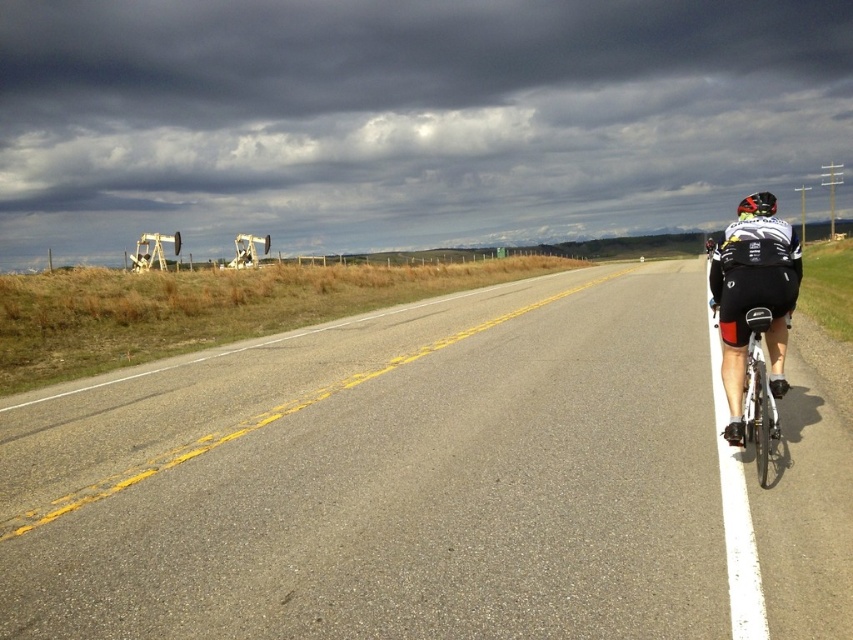
You are a cyclist approaching the shiny black helmet at right. Which direction should you turn to reach the asphalt road at center?

The asphalt road at center is to the left of the shiny black helmet at right, so you should turn left to reach it.

You are a cyclist approaching the road with two oil derricks on the left. You need to reach a point marked at coordinates (428, 481). According to the image, where exactly is this point located?

The point marked at coordinates (428, 481) is on the asphalt road at center, so you should head towards the center of the road to reach it.

You are a cyclist approaching a narrow bridge ahead. You see a black matte cycling jersey at right and a white metallic bicycle at right in your path. Which object should you steer around to avoid collision?

You should steer around the white metallic bicycle at right because the black matte cycling jersey at right is to the left of it, meaning the bicycle is closer to the right edge of the road where you are riding. Since the jersey is on the left side of the bicycle, it would be safer to move around the bicycle which is nearer to your path.